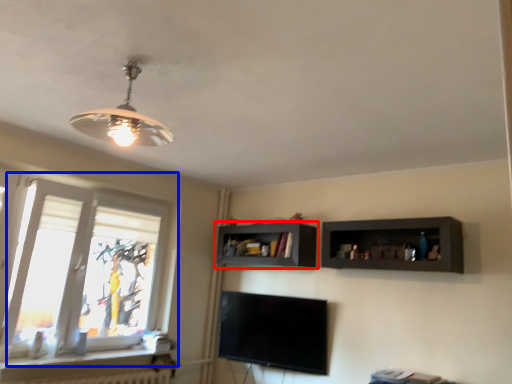
Question: Which object appears closest to the camera in this image, shelf (highlighted by a red box) or window (highlighted by a blue box)?

Choices:
 (A) shelf
 (B) window

Answer: (B)